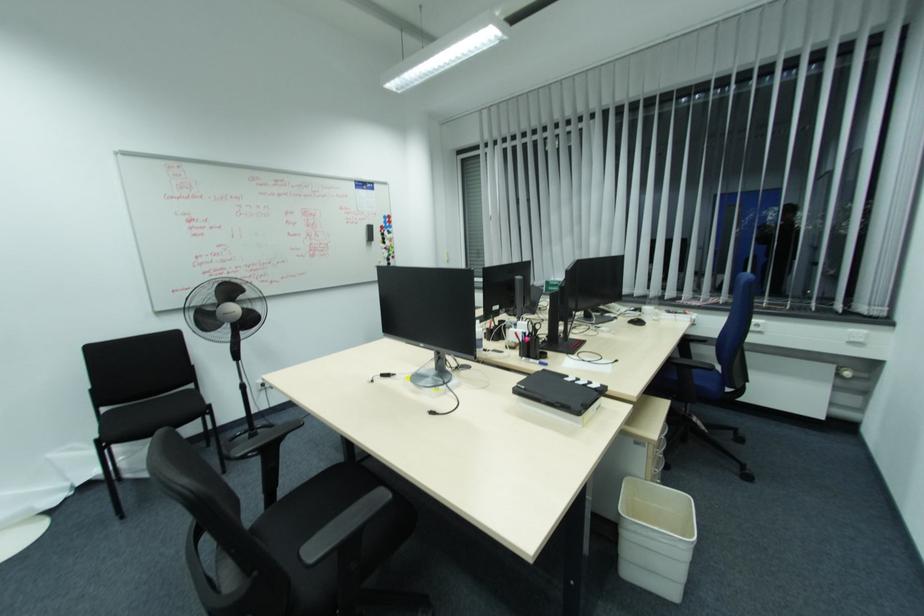
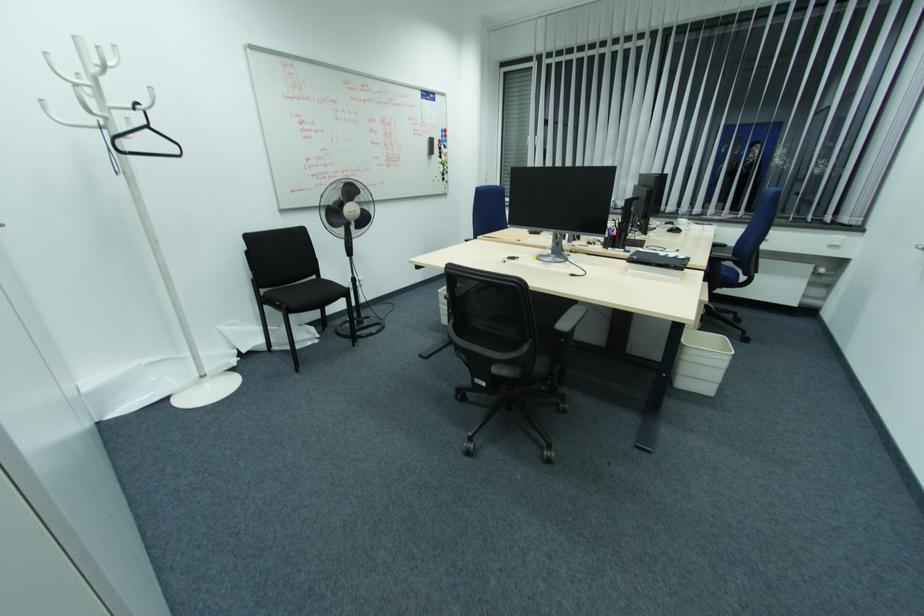
Find the pixel in the second image that matches (x=524, y=387) in the first image.

(638, 257)